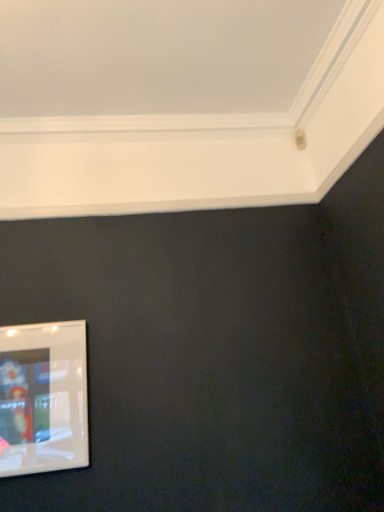
Question: Should I look upward or downward to see clear plastic picture frame at lower left?

Choices:
 (A) up
 (B) down

Answer: (B)